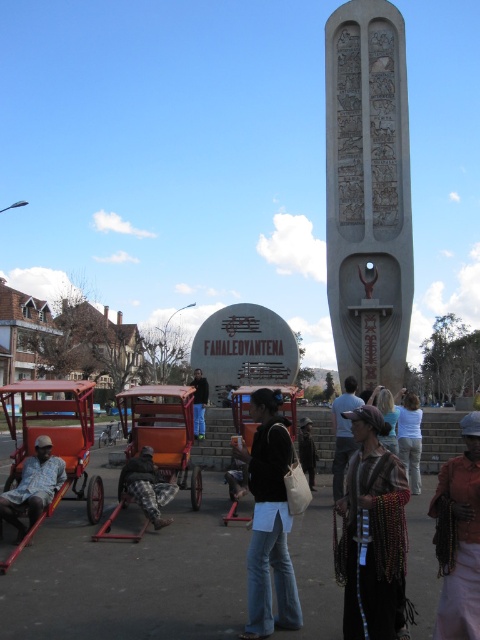
Question: Which of the following is the closest to the observer?

Choices:
 (A) (309, 424)
 (B) (289, 413)

Answer: (B)

Question: Does knitted woolen scarf at center lie behind light blue denim jeans at lower center?

Choices:
 (A) yes
 (B) no

Answer: (B)

Question: Which of these objects is positioned closest to the camouflage pants at center?

Choices:
 (A) light brown wooden chair at lower left
 (B) dark brown leather jacket at center
 (C) denim jeans at center
 (D) orange wood wagon at center

Answer: (D)

Question: Does denim jeans at center appear on the left side of light brown wooden chair at lower left?

Choices:
 (A) no
 (B) yes

Answer: (A)

Question: Which of the following is the farthest from the observer?

Choices:
 (A) (392, 444)
 (B) (278, 627)
 (C) (40, 508)
 (D) (469, 474)

Answer: (A)

Question: Can you confirm if knitted woolen scarf at center is positioned to the right of denim jeans at center?

Choices:
 (A) yes
 (B) no

Answer: (A)